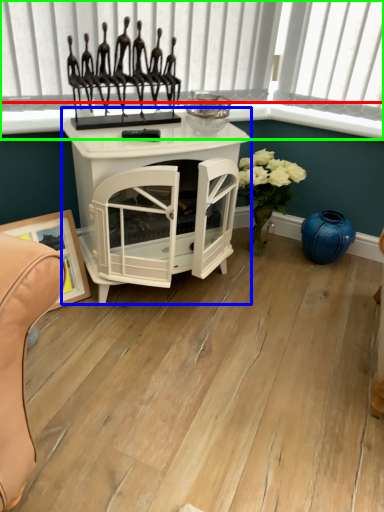
Question: Considering the real-world distances, which object is farthest from window sill (highlighted by a red box)? table (highlighted by a blue box) or window frame (highlighted by a green box)?

Choices:
 (A) table
 (B) window frame

Answer: (A)